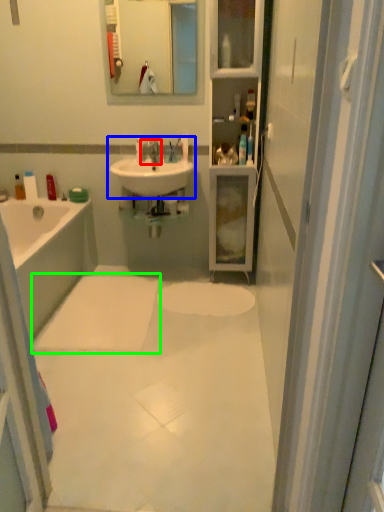
Question: Considering the real-world distances, which object is farthest from tap (highlighted by a red box)? sink (highlighted by a blue box) or bath mat (highlighted by a green box)?

Choices:
 (A) sink
 (B) bath mat

Answer: (B)